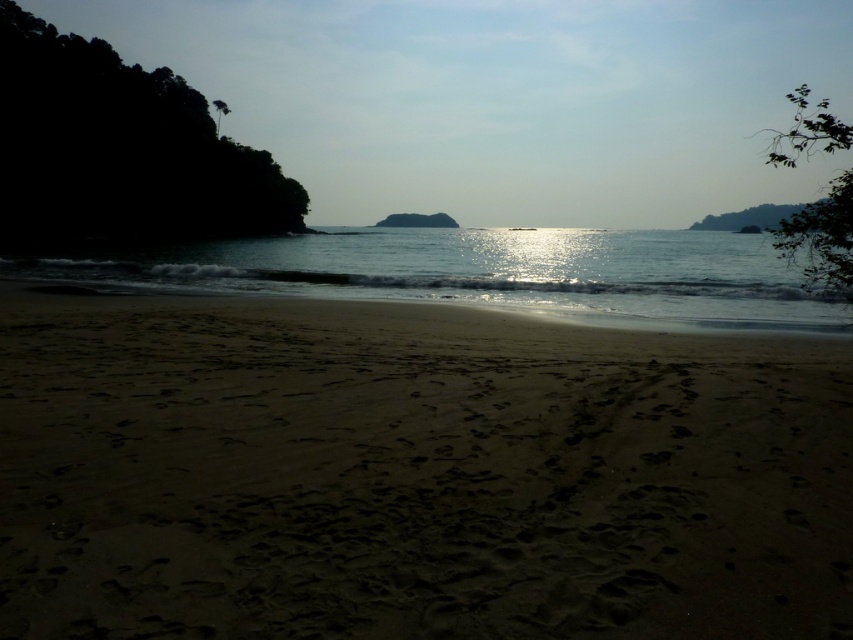
Can you confirm if light brown sand at center is positioned below shiny reflective water at center?

Yes.

Which is more to the right, light brown sand at center or shiny reflective water at center?

Positioned to the right is shiny reflective water at center.

Which is behind, point (734, 593) or point (372, 232)?

The point (372, 232) is more distant.

You are a GUI agent. You are given a task and a screenshot of the screen. Output one action in this format:
    pyautogui.click(x=<x>, y=<y>)
    Task: Click on the light brown sand at center
    The height and width of the screenshot is (640, 853).
    Given the screenshot: What is the action you would take?
    pyautogui.click(x=412, y=474)